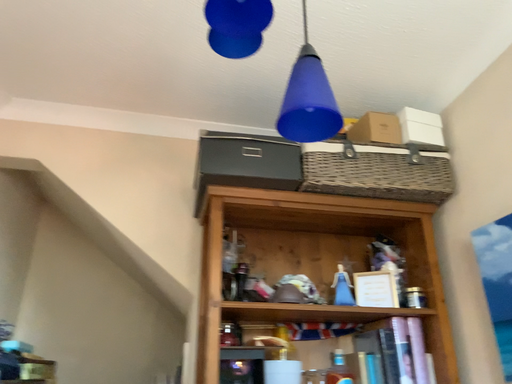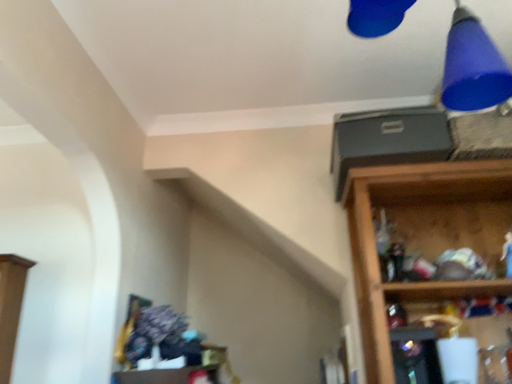
Question: How did the camera likely rotate when shooting the video?

Choices:
 (A) rotated left
 (B) rotated right

Answer: (A)